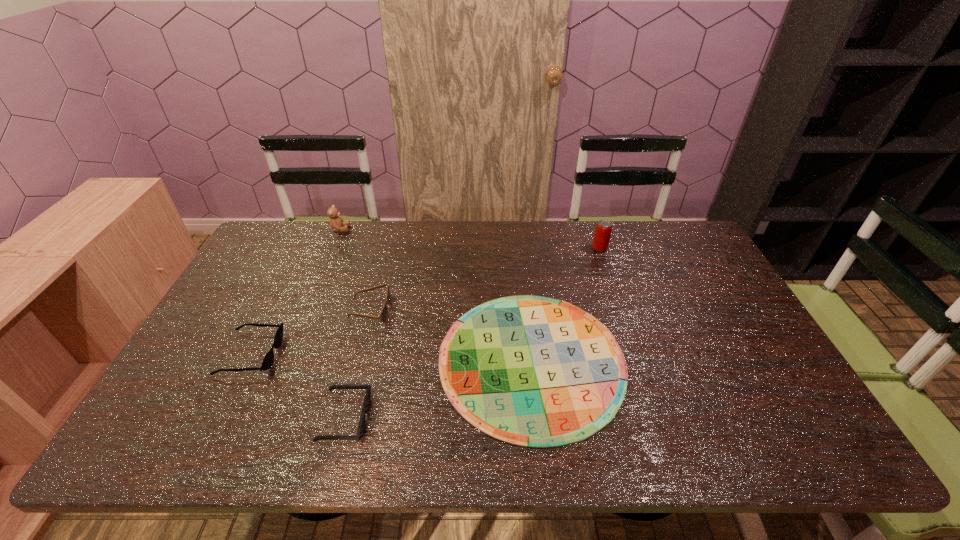
You are a GUI agent. You are given a task and a screenshot of the screen. Output one action in this format:
    pyautogui.click(x=<x>, y=<y>)
    Task: Click on the free space between the fifth object from left to right and the farthest object
    The width and height of the screenshot is (960, 540).
    Given the screenshot: What is the action you would take?
    pyautogui.click(x=436, y=295)

Identify the location of vacant area that lies between the fifth nearest object and the second farthest sunglasses. (425, 301).

I want to click on unoccupied area between the shortest sunglasses and the leftmost sunglasses, so click(x=298, y=386).

Where is `blank region between the farthest object and the farthest sunglasses`? The width and height of the screenshot is (960, 540). blank region between the farthest object and the farthest sunglasses is located at coordinates (355, 269).

Where is `free area in between the shortest sunglasses and the teddy bear`? The height and width of the screenshot is (540, 960). free area in between the shortest sunglasses and the teddy bear is located at coordinates (343, 324).

At what (x,y) coordinates should I click in order to perform the action: click on empty space between the fifth object from left to right and the second nearest sunglasses. Please return your answer as a coordinate pair (x, y). Looking at the image, I should click on (392, 357).

This screenshot has height=540, width=960. Identify the location of object that is the second closest to the gameboard. (383, 316).

Select which object appears as the second closest to the second tallest object. Please provide its 2D coordinates. Your answer should be formatted as a tuple, i.e. [(x, y)], where the tuple contains the x and y coordinates of a point satisfying the conditions above.

[(267, 362)]

Identify which sunglasses is the second nearest to the leftmost sunglasses. Please provide its 2D coordinates. Your answer should be formatted as a tuple, i.e. [(x, y)], where the tuple contains the x and y coordinates of a point satisfying the conditions above.

[(361, 427)]

Find the location of `the closest sunglasses to the leftmost sunglasses`. the closest sunglasses to the leftmost sunglasses is located at coordinates click(383, 316).